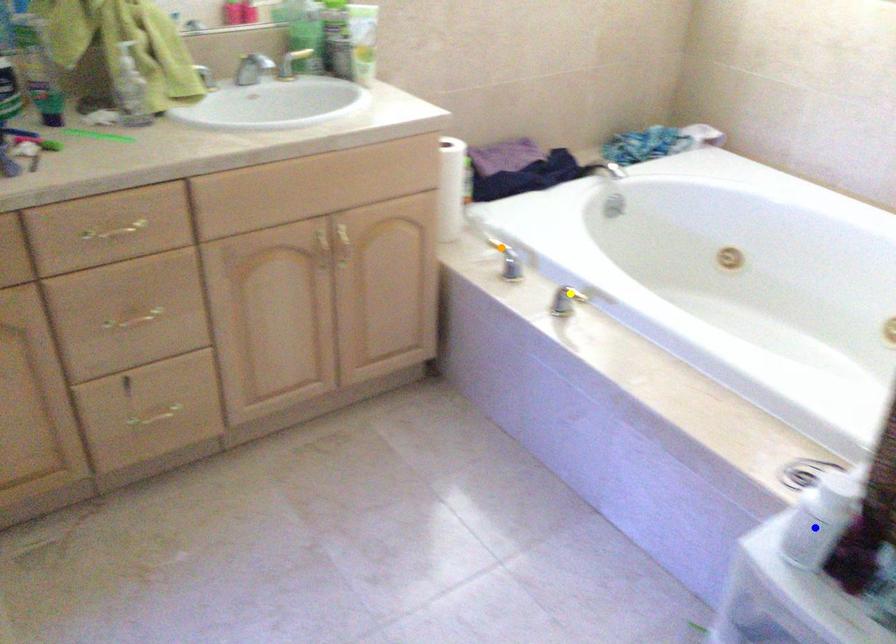
Order these from nearest to farthest:
1. orange point
2. blue point
3. yellow point

blue point < yellow point < orange point